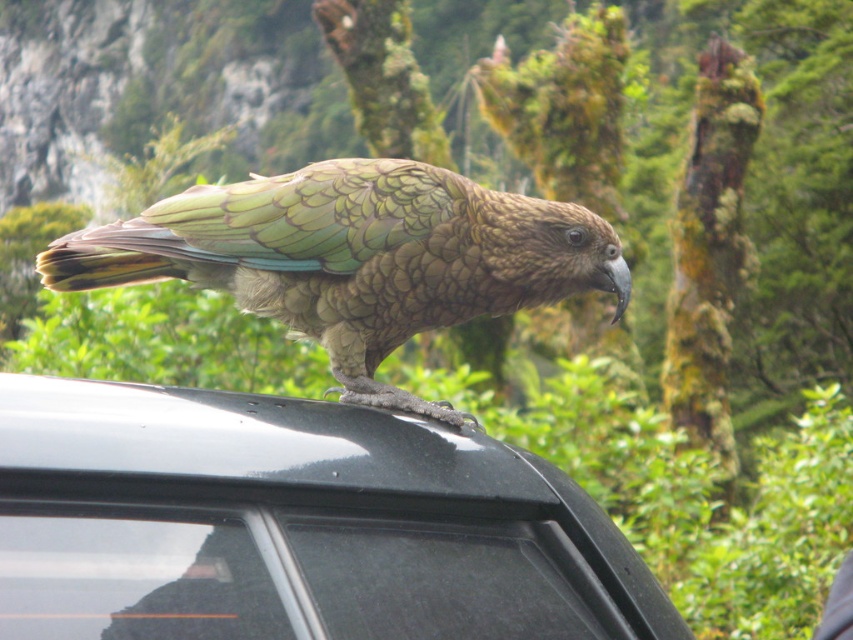
You are a photographer trying to capture a closeup shot of the green scaly parrot at center perched on the glossy black car at top. Since the car is larger, will you need to move closer or farther away to focus on the parrot?

The glossy black car at top is larger in size than the green scaly parrot at center. To focus on the smaller green scaly parrot at center, you would need to move closer to it.

You are a photographer standing at the center of a parking lot. You want to take a photo of the glossy black car at top. Where should you position yourself relative to the car to ensure the bird perched on its roof is visible in the frame?

To capture the bird perched on the glossy black car at top in your photo, position yourself at point [341,508] relative to the car, as this is where the glossy black car at top is located.

You are a delivery person who needs to place a package on the roof of the glossy black car at top without disturbing the green scaly parrot at center. Can you do this safely?

The glossy black car at top is located below the green scaly parrot at center, so placing the package on the roof would require moving the parrot first to avoid disturbing it.